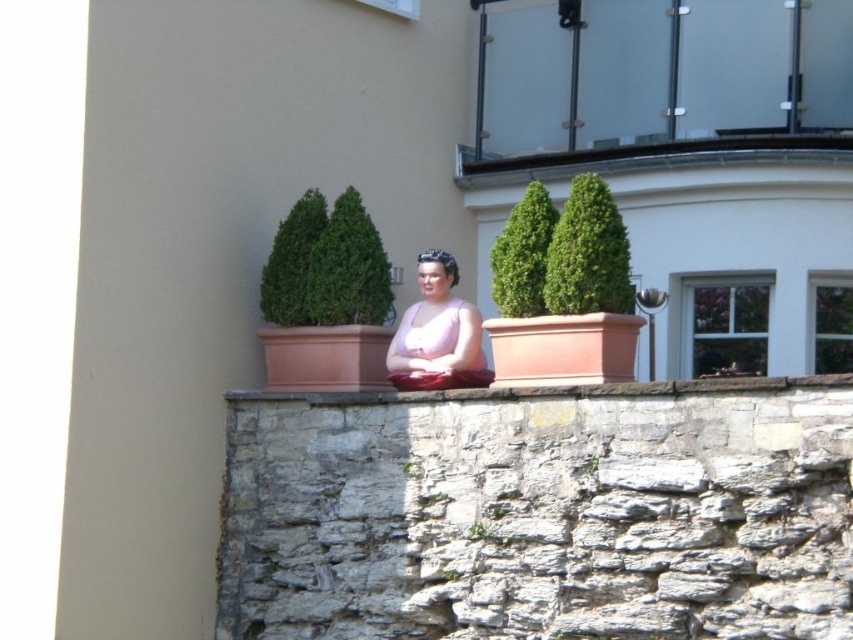
Which is more to the left, pink matte dress at center or stone ledge at center?

pink matte dress at center

Describe the element at coordinates (437, 333) in the screenshot. The width and height of the screenshot is (853, 640). I see `pink matte dress at center` at that location.

Is point (387, 362) closer to viewer compared to point (454, 396)?

No, (387, 362) is further to viewer.

Find the location of `pink matte dress at center`. pink matte dress at center is located at coordinates 437,333.